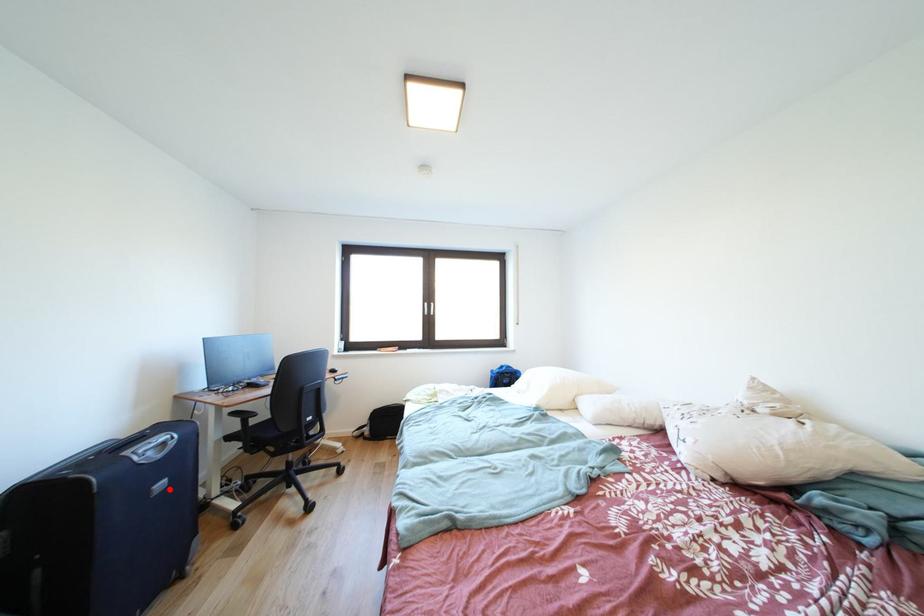
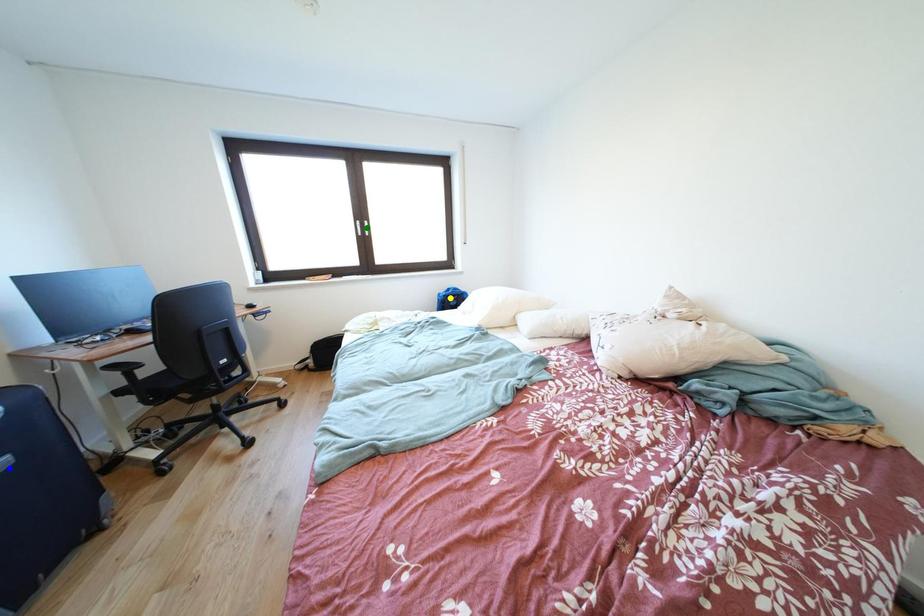
Question: I am providing you with two images of the same scene from different viewpoints. A red point is marked on the first image. You are given multiple points on the second image. In image 2, which mark is for the same physical point as the one in image 1?

Choices:
 (A) green point
 (B) yellow point
 (C) blue point

Answer: (C)